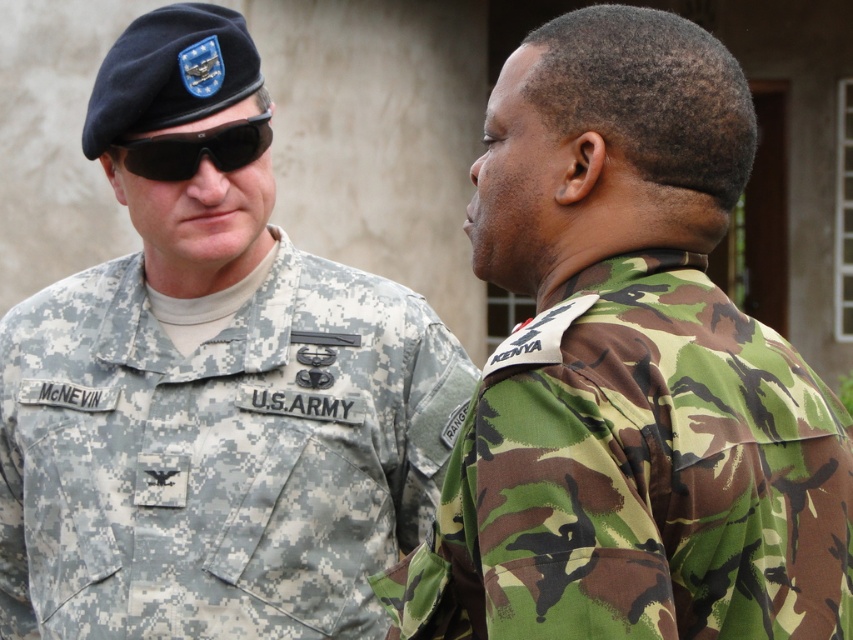
Is the position of camouflage fabric uniform at right less distant than that of digital camouflage uniform at left?

Yes, it is in front of digital camouflage uniform at left.

Can you confirm if camouflage fabric uniform at right is taller than digital camouflage uniform at left?

In fact, camouflage fabric uniform at right may be shorter than digital camouflage uniform at left.

The image size is (853, 640). In order to click on camouflage fabric uniform at right in this screenshot , I will do `click(630, 371)`.

Between camouflage fabric uniform at right and black matte goggles at upper left, which one appears on the left side from the viewer's perspective?

Positioned to the left is black matte goggles at upper left.

Can you confirm if camouflage fabric uniform at right is positioned below black matte goggles at upper left?

Yes, camouflage fabric uniform at right is below black matte goggles at upper left.

The width and height of the screenshot is (853, 640). What do you see at coordinates (630, 371) in the screenshot?
I see `camouflage fabric uniform at right` at bounding box center [630, 371].

Identify the location of camouflage fabric uniform at right. (630, 371).

Consider the image. Is the position of digital camouflage uniform at left less distant than that of black matte goggles at upper left?

Yes, digital camouflage uniform at left is closer to the viewer.

The image size is (853, 640). Describe the element at coordinates (212, 392) in the screenshot. I see `digital camouflage uniform at left` at that location.

Does point (161, 412) come in front of point (202, 132)?

No, (161, 412) is behind (202, 132).

Find the location of `digital camouflage uniform at left`. digital camouflage uniform at left is located at coordinates (212, 392).